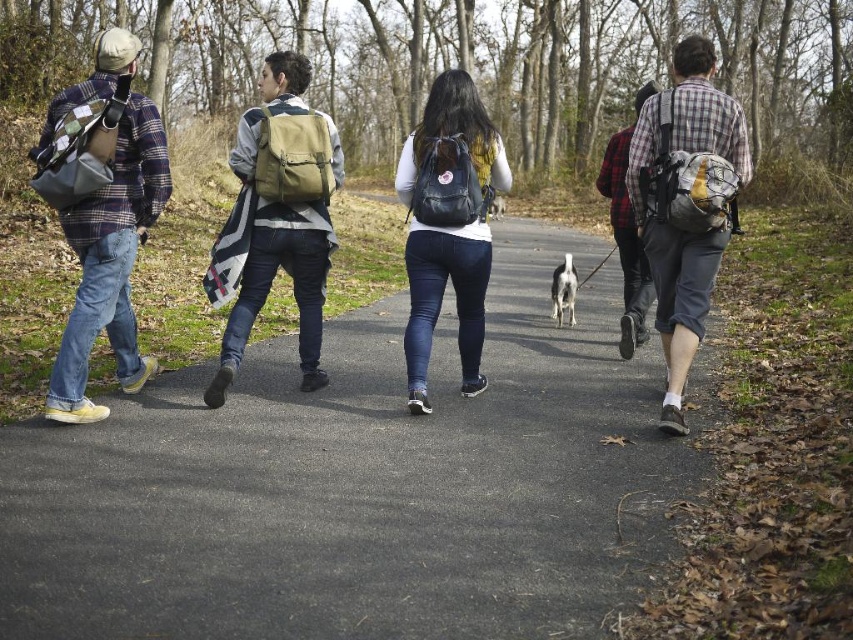
Is plaid flannel shirt at center further to camera compared to plaid flannel shirt at left?

Yes, plaid flannel shirt at center is behind plaid flannel shirt at left.

Who is more distant from viewer, (x=683, y=364) or (x=99, y=70)?

The point (x=683, y=364) is more distant.

You are a GUI agent. You are given a task and a screenshot of the screen. Output one action in this format:
    pyautogui.click(x=<x>, y=<y>)
    Task: Click on the plaid flannel shirt at center
    The width and height of the screenshot is (853, 640).
    Given the screenshot: What is the action you would take?
    pyautogui.click(x=686, y=204)

Is the position of black backpack at center more distant than that of plaid flannel shirt at center-right?

Yes, it is behind plaid flannel shirt at center-right.

Is black backpack at center closer to camera compared to plaid flannel shirt at center-right?

No, it is behind plaid flannel shirt at center-right.

You are a GUI agent. You are given a task and a screenshot of the screen. Output one action in this format:
    pyautogui.click(x=<x>, y=<y>)
    Task: Click on the black backpack at center
    The image size is (853, 640).
    Given the screenshot: What is the action you would take?
    pyautogui.click(x=360, y=484)

Is plaid flannel shirt at left to the right of black matte backpack at center from the viewer's perspective?

Incorrect, plaid flannel shirt at left is not on the right side of black matte backpack at center.

Between point (119, 44) and point (422, 376), which one is positioned behind?

Positioned behind is point (422, 376).

Does point (125, 116) come behind point (468, 307)?

No.

At what (x,y) coordinates should I click in order to perform the action: click on plaid flannel shirt at left. Please return your answer as a coordinate pair (x, y). The image size is (853, 640). Looking at the image, I should click on click(107, 225).